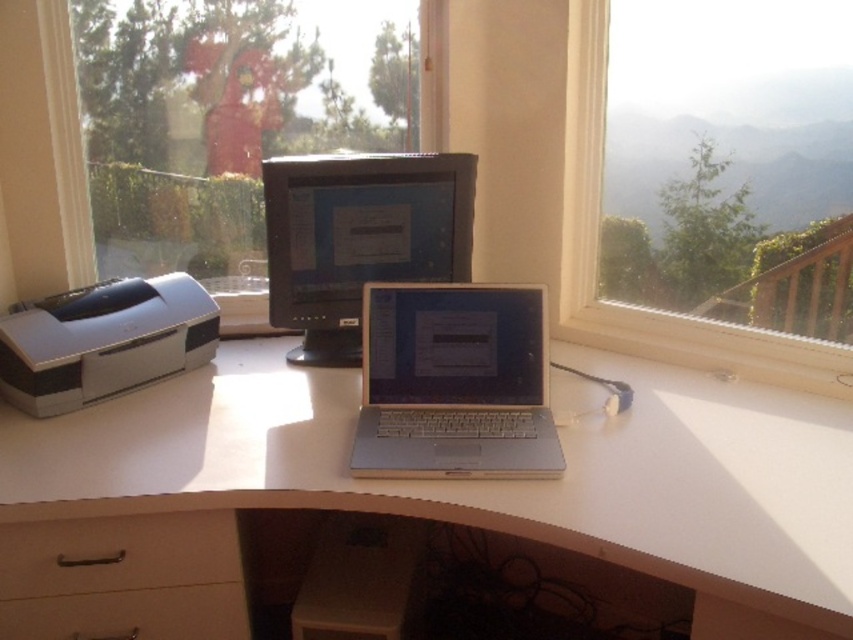
Question: Which point is farther to the camera?

Choices:
 (A) (224, 125)
 (B) (392, 312)

Answer: (A)

Question: Can you confirm if white wood computer desk at center is bigger than brown matte drawer at lower left?

Choices:
 (A) yes
 (B) no

Answer: (A)

Question: Does transparent glass window at left have a lesser width compared to white glossy printer at left?

Choices:
 (A) yes
 (B) no

Answer: (B)

Question: Is satin black monitor at center to the left of white glossy printer at left from the viewer's perspective?

Choices:
 (A) yes
 (B) no

Answer: (B)

Question: Estimate the real-world distances between objects in this image. Which object is closer to the silver metallic laptop at center?

Choices:
 (A) white glossy printer at left
 (B) white wood computer desk at center
 (C) transparent glass window at left
 (D) brown matte drawer at lower left

Answer: (B)

Question: Which object is farther from the camera taking this photo?

Choices:
 (A) transparent glass window at left
 (B) white matte drawer at lower left

Answer: (A)